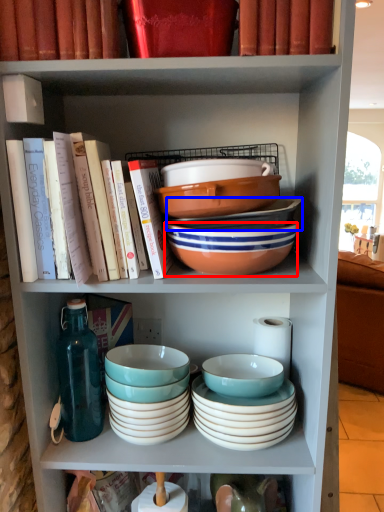
Question: Among these objects, which one is farthest to the camera, bowl (highlighted by a red box) or bowl (highlighted by a blue box)?

Choices:
 (A) bowl
 (B) bowl

Answer: (B)